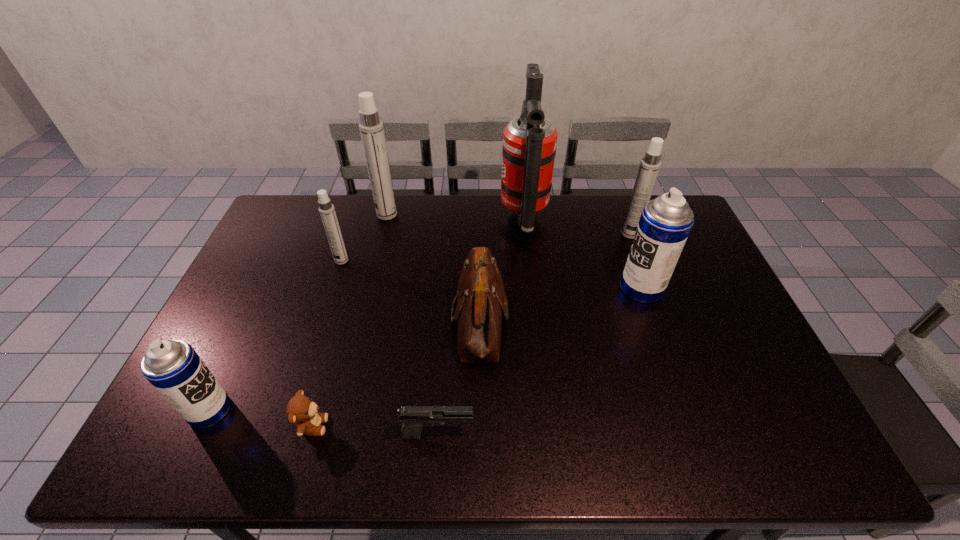
Find the location of `teddy bear that is at the near edge`. teddy bear that is at the near edge is located at coordinates (301, 410).

The image size is (960, 540). In order to click on object positioned at the left edge in this screenshot , I will do `click(173, 367)`.

The height and width of the screenshot is (540, 960). What are the coordinates of `object at the near left corner` in the screenshot? It's located at (173, 367).

Locate an element on the screen. vacant point at the far edge is located at coordinates (587, 207).

At what (x,y) coordinates should I click in order to perform the action: click on vacant area at the near edge. Please return your answer as a coordinate pair (x, y). The height and width of the screenshot is (540, 960). Looking at the image, I should click on (731, 464).

Locate an element on the screen. The height and width of the screenshot is (540, 960). free space at the left edge is located at coordinates (258, 256).

At what (x,y) coordinates should I click in order to perform the action: click on blank area at the right edge. Please return your answer as a coordinate pair (x, y). Looking at the image, I should click on (x=707, y=303).

Where is `vacant region between the fire extinguisher and the rightmost white aerosol can`? vacant region between the fire extinguisher and the rightmost white aerosol can is located at coordinates (577, 226).

Where is `empty space between the second aerosol can from left to right and the tallest aerosol can`? empty space between the second aerosol can from left to right and the tallest aerosol can is located at coordinates (364, 238).

Locate an element on the screen. Image resolution: width=960 pixels, height=540 pixels. free spot between the teddy bear and the leftmost white aerosol can is located at coordinates (327, 343).